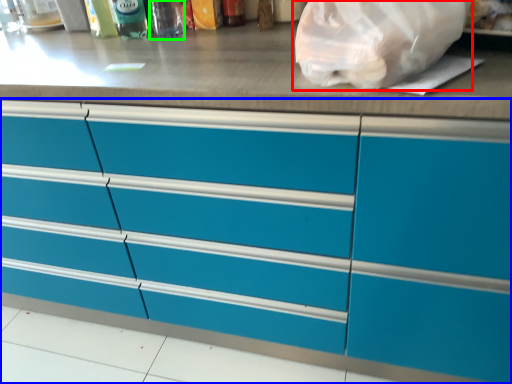
Question: Which object is positioned closest to plastic bag (highlighted by a red box)? Select from cabinetry (highlighted by a blue box) and bottle (highlighted by a green box).

Choices:
 (A) cabinetry
 (B) bottle

Answer: (A)